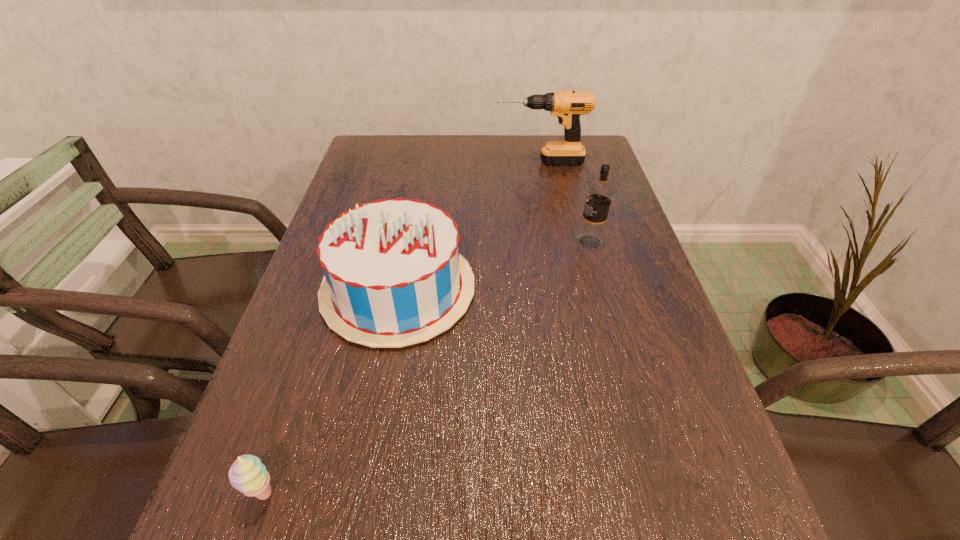
Locate an element on the screen. This screenshot has height=540, width=960. vacant space at the left edge of the desktop is located at coordinates (296, 301).

Identify the location of vacant space at the right edge of the desktop. (636, 429).

Where is `vacant region at the far left corner`? The image size is (960, 540). vacant region at the far left corner is located at coordinates coord(367,155).

Where is `vacant space that's between the drill and the birthday cake`? vacant space that's between the drill and the birthday cake is located at coordinates (469, 226).

Identify the location of free space between the birthday cake and the farthest object. (469, 226).

You are a GUI agent. You are given a task and a screenshot of the screen. Output one action in this format:
    pyautogui.click(x=<x>, y=<y>)
    Task: Click on the empty location between the shortest object and the vodka
    This screenshot has height=540, width=960.
    Given the screenshot: What is the action you would take?
    pyautogui.click(x=426, y=368)

Locate an element on the screen. This screenshot has width=960, height=540. free space that is in between the birthday cake and the nearest object is located at coordinates (331, 392).

Identify the location of free spot between the vodka and the sherbert. Image resolution: width=960 pixels, height=540 pixels. (426, 368).

I want to click on vacant area between the birthday cake and the drill, so click(469, 226).

Where is `vacant space that's between the vodka and the drill`? vacant space that's between the vodka and the drill is located at coordinates (564, 202).